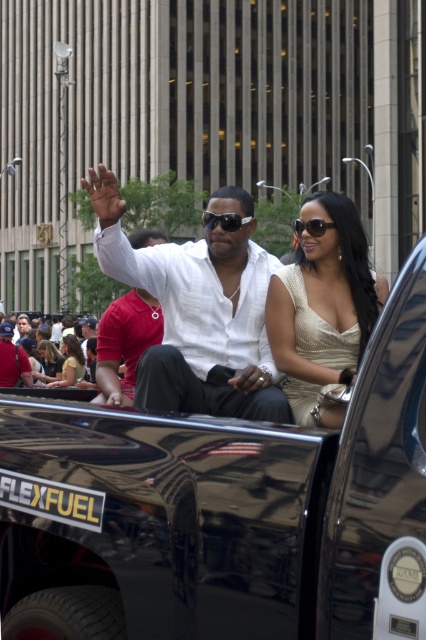
Question: Which point appears farthest from the camera in this image?

Choices:
 (A) (71, 365)
 (B) (54, 346)

Answer: (B)

Question: Is the position of white glossy shirt at center less distant than that of light brown leather chairs at lower left?

Choices:
 (A) yes
 (B) no

Answer: (A)

Question: Can you confirm if satin beige dress at center is positioned to the left of light yellow fabric shirt at center?

Choices:
 (A) yes
 (B) no

Answer: (B)

Question: Among these objects, which one is farthest from the camera?

Choices:
 (A) light yellow fabric shirt at center
 (B) black plastic sunglasses at center
 (C) matte black dress at center

Answer: (C)

Question: Based on their relative distances, which object is farther from the light brown leather chairs at lower left?

Choices:
 (A) light yellow fabric shirt at center
 (B) white glossy shirt at center
 (C) matte black dress at center
 (D) black plastic sunglasses at center

Answer: (B)

Question: Can you confirm if white cotton shirt at center is thinner than light yellow fabric shirt at center?

Choices:
 (A) yes
 (B) no

Answer: (B)